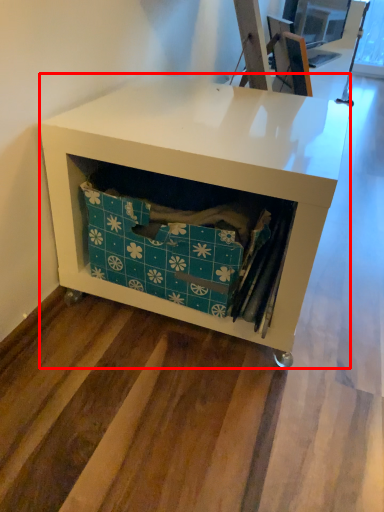
Question: From the image's perspective, what is the correct spatial positioning of desk (annotated by the red box) in reference to storage box?

Choices:
 (A) below
 (B) above

Answer: (B)